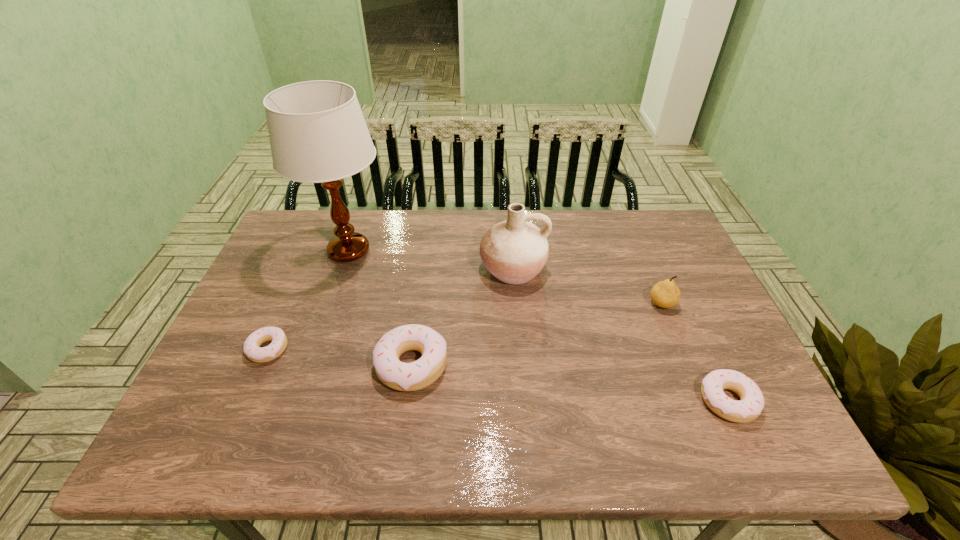
Identify the location of the shortest object. (252, 350).

You are a GUI agent. You are given a task and a screenshot of the screen. Output one action in this format:
    pyautogui.click(x=<x>, y=<y>)
    Task: Click on the leftmost doughnut
    
    Given the screenshot: What is the action you would take?
    pyautogui.click(x=252, y=350)

You are a GUI agent. You are given a task and a screenshot of the screen. Output one action in this format:
    pyautogui.click(x=<x>, y=<y>)
    Task: Click on the tallest doughnut
    
    Given the screenshot: What is the action you would take?
    pyautogui.click(x=421, y=373)

Locate an element on the screen. This screenshot has height=540, width=960. the second doughnut from left to right is located at coordinates (421, 373).

Image resolution: width=960 pixels, height=540 pixels. I want to click on the rightmost doughnut, so click(751, 403).

At what (x,y) coordinates should I click in order to perform the action: click on the second shortest object. Please return your answer as a coordinate pair (x, y). The height and width of the screenshot is (540, 960). Looking at the image, I should click on (751, 403).

The image size is (960, 540). Identify the location of the tallest object. click(317, 132).

Locate an element on the screen. The image size is (960, 540). pear is located at coordinates (665, 294).

Find the location of a particular element. The image size is (960, 540). the fourth nearest object is located at coordinates (665, 294).

This screenshot has height=540, width=960. In order to click on the fourth object from left to right in this screenshot , I will do `click(514, 251)`.